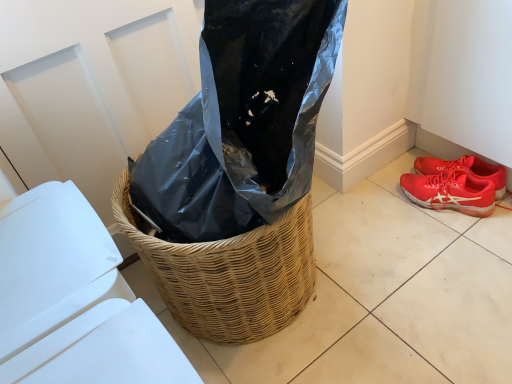
The image size is (512, 384). I want to click on free space to the left of red mesh shoe at lower right, the 2th footwear positioned from the bottom, so click(389, 208).